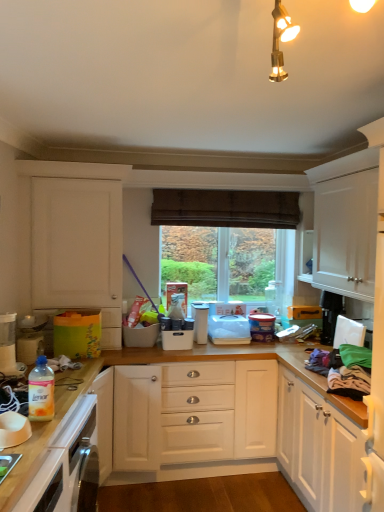
Question: Is black plastic toaster at upper right, which appears as the first appliance when viewed from the right, with white plastic bowl at lower left?

Choices:
 (A) yes
 (B) no

Answer: (B)

Question: Is white plastic bowl at lower left surrounded by black plastic toaster at upper right, which appears as the first appliance when viewed from the right?

Choices:
 (A) yes
 (B) no

Answer: (B)

Question: Is black plastic toaster at upper right, which appears as the first appliance when viewed from the right, behind white plastic bowl at lower left?

Choices:
 (A) no
 (B) yes

Answer: (B)

Question: From the image's perspective, would you say black plastic toaster at upper right, which appears as the first appliance when viewed from the right, is positioned over white plastic bowl at lower left?

Choices:
 (A) no
 (B) yes

Answer: (B)

Question: Is black plastic toaster at upper right, which appears as the first appliance when viewed from the right, outside white plastic bowl at lower left?

Choices:
 (A) yes
 (B) no

Answer: (A)

Question: Can you confirm if black plastic toaster at upper right, which appears as the first appliance when viewed from the right, is shorter than white plastic bowl at lower left?

Choices:
 (A) yes
 (B) no

Answer: (B)

Question: Are white plastic bowl at lower left and translucent plastic bottle at lower left beside each other?

Choices:
 (A) yes
 (B) no

Answer: (B)

Question: From the image's perspective, does white plastic bowl at lower left appear higher than translucent plastic bottle at lower left?

Choices:
 (A) yes
 (B) no

Answer: (B)

Question: Is white plastic bowl at lower left at the left side of translucent plastic bottle at lower left?

Choices:
 (A) no
 (B) yes

Answer: (A)

Question: Is white plastic bowl at lower left shorter than translucent plastic bottle at lower left?

Choices:
 (A) no
 (B) yes

Answer: (B)

Question: Does white plastic bowl at lower left appear on the right side of translucent plastic bottle at lower left?

Choices:
 (A) yes
 (B) no

Answer: (A)

Question: From the image's perspective, does white plastic bowl at lower left appear lower than translucent plastic bottle at lower left?

Choices:
 (A) yes
 (B) no

Answer: (A)

Question: Can we say white plastic container at center, acting as the 2th appliance starting from the left, lies outside white plastic container at center, placed as the fourth appliance when sorted from right to left?

Choices:
 (A) yes
 (B) no

Answer: (A)